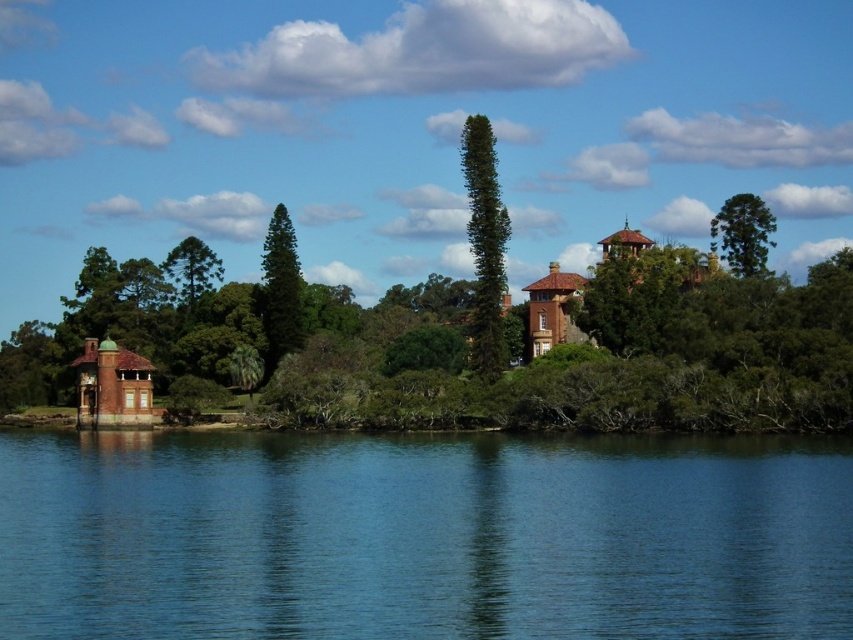
Question: Does green textured tree at center have a greater width compared to green glossy tree at center?

Choices:
 (A) yes
 (B) no

Answer: (B)

Question: Can you confirm if green textured tree at center is smaller than green textured tree at upper center?

Choices:
 (A) yes
 (B) no

Answer: (A)

Question: Which point appears farthest from the camera in this image?

Choices:
 (A) (502, 289)
 (B) (183, 282)
 (C) (299, 268)
 (D) (743, 236)

Answer: (B)

Question: Does green textured tree at center appear on the left side of green textured tree at upper center?

Choices:
 (A) yes
 (B) no

Answer: (B)

Question: Estimate the real-world distances between objects in this image. Which object is farther from the green glossy tree at center?

Choices:
 (A) green textured tree at upper right
 (B) green textured tree at upper center
 (C) green textured tree at center

Answer: (A)

Question: Among these objects, which one is farthest from the camera?

Choices:
 (A) green textured tree at center
 (B) green textured tree at upper right
 (C) green glossy tree at center
 (D) transparent blue water at center

Answer: (B)